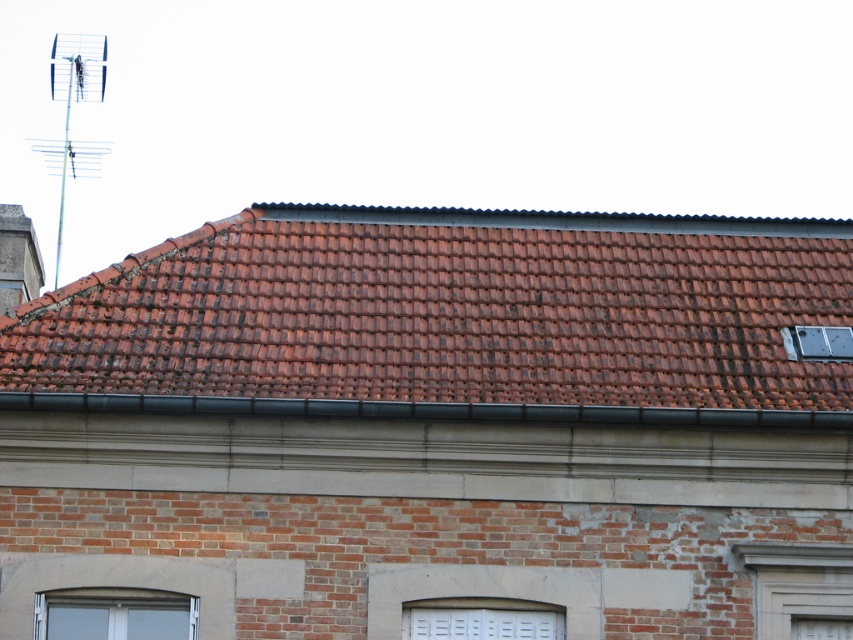
Consider the image. You are a construction worker inspecting the roof of a building. You notice a point at coordinates (453, 314). What material is present at that point?

The point at coordinates (453, 314) has brown clay tiles at upper center.

You are standing on the ground floor of the building and looking up at the brown clay tiles at upper center and the matte glass window at lower left. Which object appears nearer to you?

The brown clay tiles at upper center appears nearer to you because they are closer to the viewer than the matte glass window at lower left.